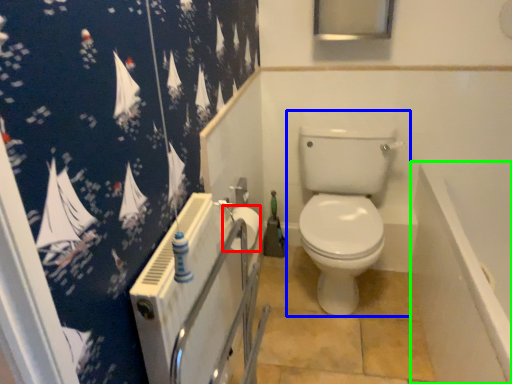
Question: Which object is the farthest from toilet paper (highlighted by a red box)? Choose among these: toilet (highlighted by a blue box) or bath (highlighted by a green box).

Choices:
 (A) toilet
 (B) bath

Answer: (B)